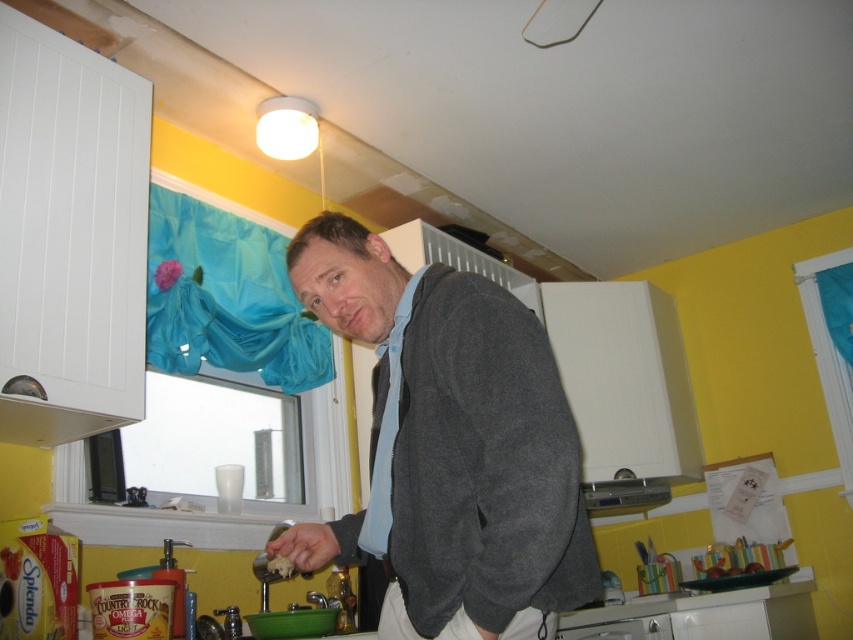
You are organizing the kitchen and need to place the gray wool sweater at center and the white crumbly food at lower center into containers. The sweater container must be wider than the food container. Which object requires a wider container?

The gray wool sweater at center requires a wider container because its width surpasses that of the white crumbly food at lower center.

You are a chef preparing to clean the kitchen. You notice the gray wool sweater at center and the white crumbly food at lower center. Which item is positioned higher up in the scene?

The gray wool sweater at center is taller than the white crumbly food at lower center, so the gray wool sweater at center is positioned higher up.

You are a housekeeper cleaning the kitchen. You see the gray wool sweater at center and the white crumbly food at lower center. Which object is located to the right of the other?

The gray wool sweater at center is to the right of the white crumbly food at lower center.